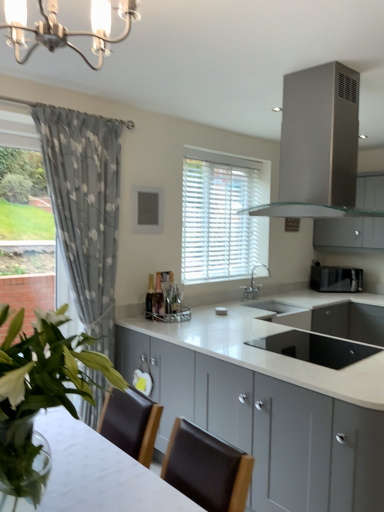
Image resolution: width=384 pixels, height=512 pixels. Find the location of `empty space that is ontop of black glass sink at center, the second appliance in the top-to-bottom sequence (from a real-world perspective)`. empty space that is ontop of black glass sink at center, the second appliance in the top-to-bottom sequence (from a real-world perspective) is located at coordinates (326, 339).